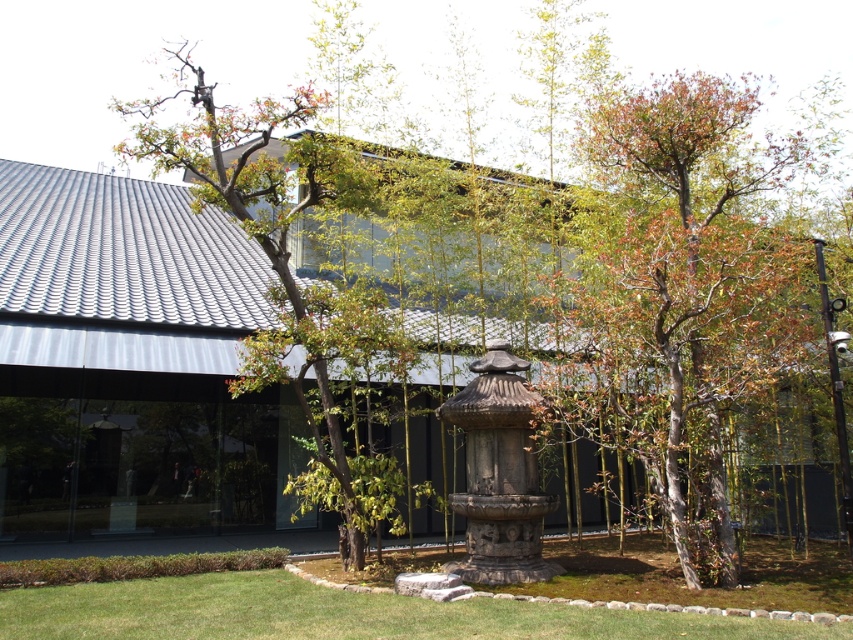
Does smooth gray stone statue at center appear over green leafy tree at upper center?

Actually, smooth gray stone statue at center is below green leafy tree at upper center.

Between smooth gray stone statue at center and green leafy tree at upper center, which one appears on the left side from the viewer's perspective?

Positioned to the left is green leafy tree at upper center.

Is point (842, 444) positioned before point (350, 189)?

Yes, it is.

Identify the location of smooth gray stone statue at center. (677, 296).

Which is behind, point (665, 513) or point (613, 621)?

Point (665, 513)

Who is lower down, smooth gray stone statue at center or green grass at lower center?

Positioned lower is green grass at lower center.

In order to click on smooth gray stone statue at center in this screenshot , I will do `click(677, 296)`.

Where is `smooth gray stone statue at center`? This screenshot has width=853, height=640. smooth gray stone statue at center is located at coordinates [677, 296].

Is point (322, 413) more distant than point (706, 620)?

That is True.

Can you confirm if green leafy tree at upper center is taller than green grass at lower center?

Yes, green leafy tree at upper center is taller than green grass at lower center.

Is point (225, 129) behind point (57, 614)?

That is True.

Find the location of `green leafy tree at upper center`. green leafy tree at upper center is located at coordinates (289, 269).